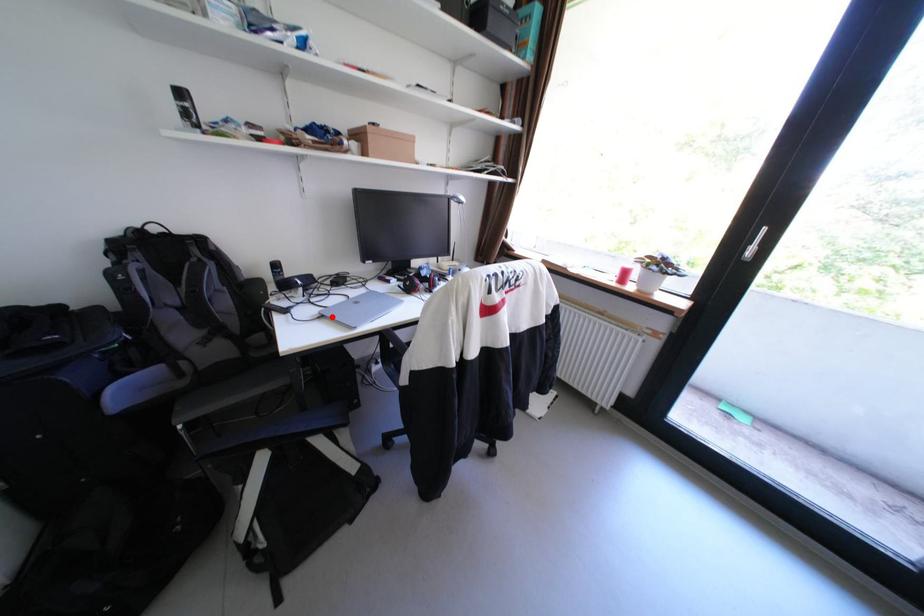
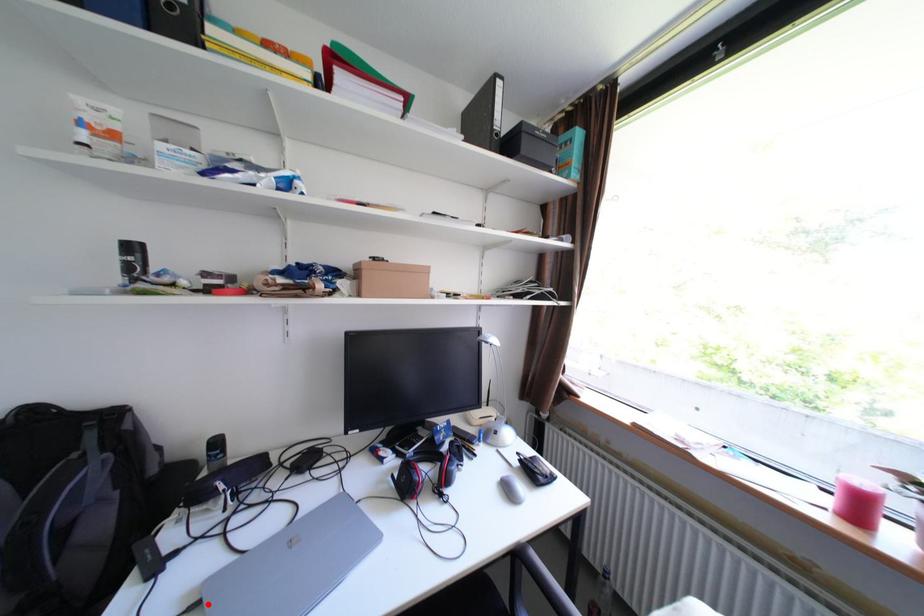
I am providing you with two images of the same scene from different viewpoints. A red point is marked on the first image and another point is marked on the second image. Are the points marked in image1 and image2 representing the same 3D position?

Yes